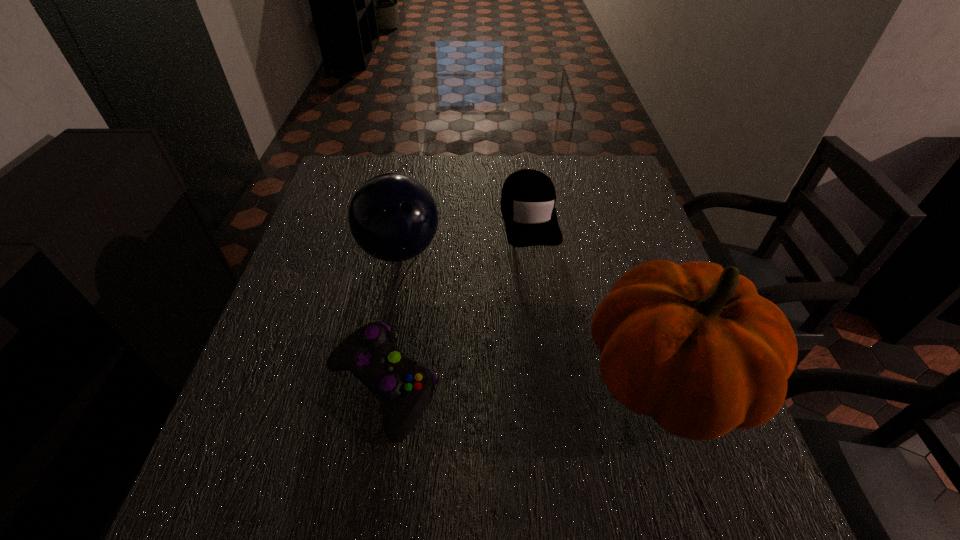
Locate an element on the screen. free location that satisfies the following two spatial constraints: 1. on the front side of the pumpkin; 2. on the right side of the cap is located at coordinates (550, 379).